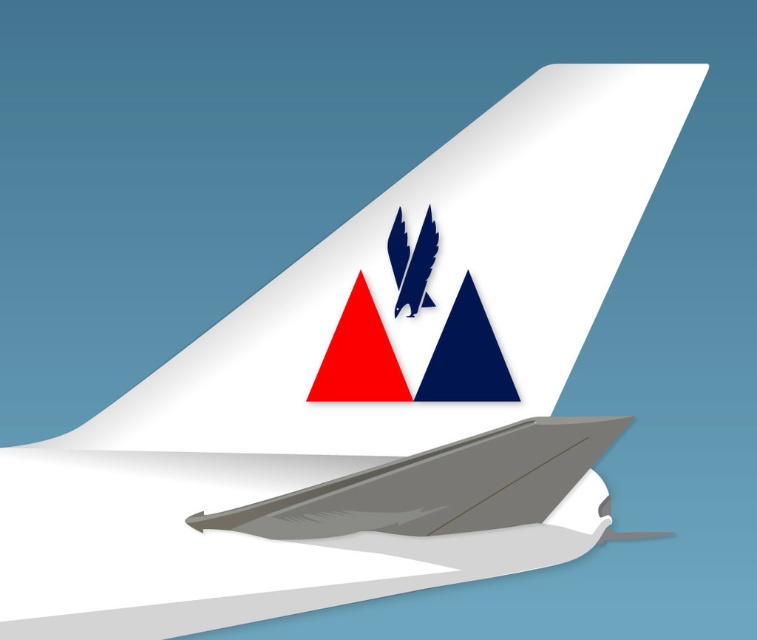
You are an aviation engineer inspecting an airplane tail fin. You notice the matte gray winglet at lower center and the blue glossy eagle at upper center. Which object is taller in this design?

The matte gray winglet at lower center is taller than the blue glossy eagle at upper center according to the design specifications.

You are an aviation designer reviewing an airplane tail fin design. You notice the red matte triangle at upper center and the blue glossy eagle at upper center. Which object is positioned higher in the image?

The blue glossy eagle at upper center is positioned higher than the red matte triangle at upper center.